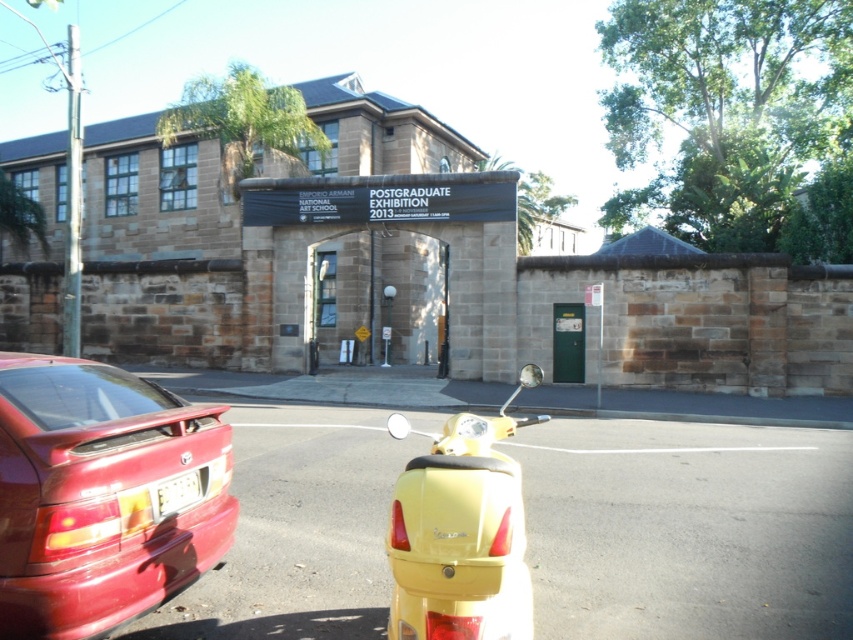
Is glossy red car at lower left positioned in front of yellow plastic license plate at lower center?

Yes, it is in front of yellow plastic license plate at lower center.

Who is more forward, (207,554) or (164,488)?

Point (164,488) is in front.

Find the location of a particular element. glossy red car at lower left is located at coordinates (100, 496).

Can you confirm if glossy red car at lower left is positioned to the right of yellow matte scooter at center?

Incorrect, glossy red car at lower left is not on the right side of yellow matte scooter at center.

Who is higher up, glossy red car at lower left or yellow matte scooter at center?

Positioned higher is glossy red car at lower left.

Who is more distant from viewer, (47, 625) or (430, 531)?

The point (47, 625) is behind.

Image resolution: width=853 pixels, height=640 pixels. Identify the location of glossy red car at lower left. (100, 496).

Is yellow matte scooter at center taller than yellow plastic license plate at lower center?

Yes, yellow matte scooter at center is taller than yellow plastic license plate at lower center.

Can you confirm if yellow matte scooter at center is smaller than yellow plastic license plate at lower center?

No.

Is point (393, 486) positioned in front of point (158, 490)?

No, it is not.

Where is `yellow matte scooter at center`? yellow matte scooter at center is located at coordinates (461, 534).